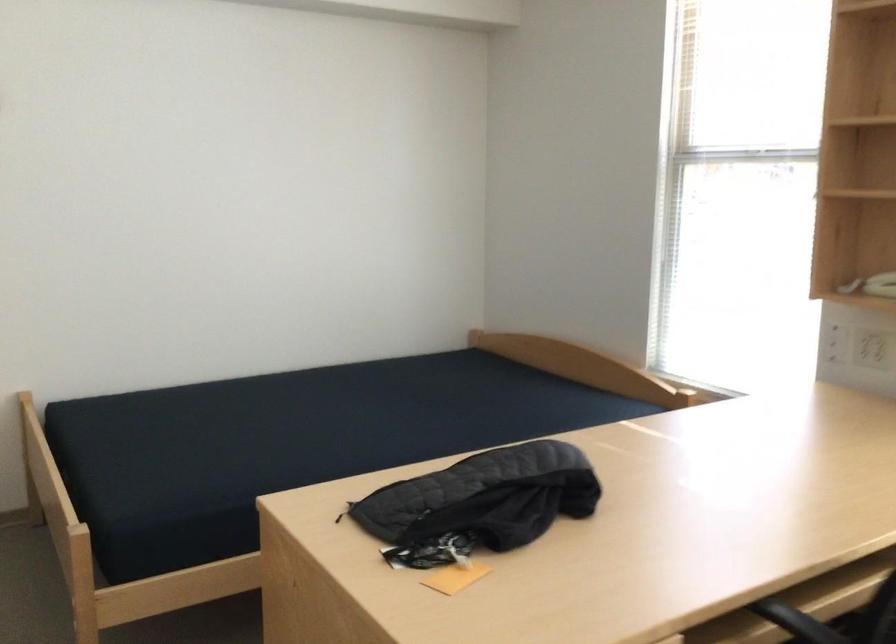
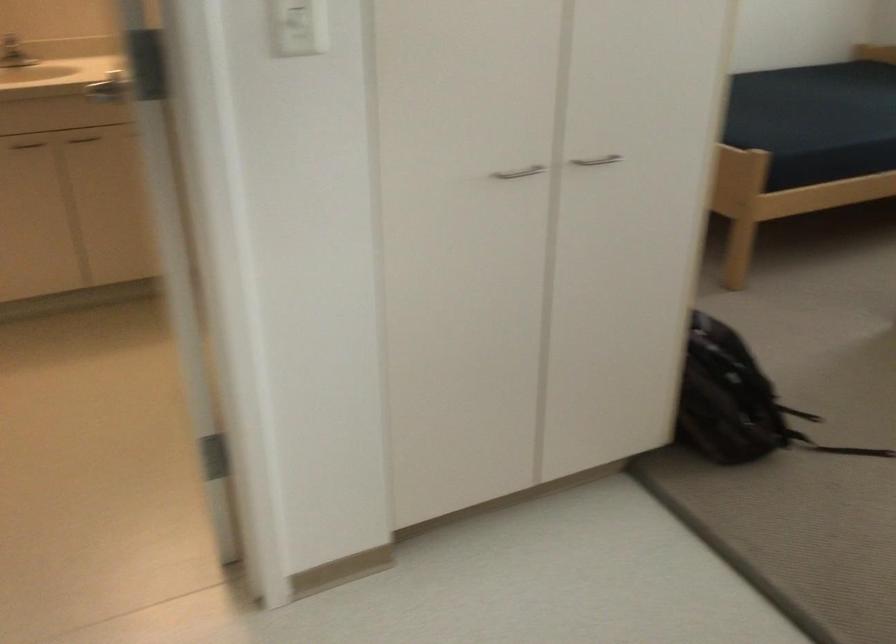
Which direction would the cameraman need to move to produce the second image?

The cameraman walked toward left, backward.